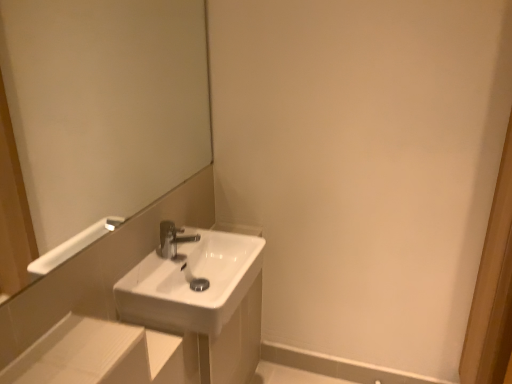
Question: Is white glossy mirror at upper left located within white glossy sink at center?

Choices:
 (A) no
 (B) yes

Answer: (A)

Question: Is white glossy sink at center oriented towards white glossy mirror at upper left?

Choices:
 (A) yes
 (B) no

Answer: (B)

Question: Can we say white glossy sink at center lies outside white glossy mirror at upper left?

Choices:
 (A) no
 (B) yes

Answer: (B)

Question: Is white glossy mirror at upper left at the back of white glossy sink at center?

Choices:
 (A) no
 (B) yes

Answer: (A)

Question: Can you confirm if white glossy sink at center is wider than white glossy mirror at upper left?

Choices:
 (A) yes
 (B) no

Answer: (A)

Question: Does white glossy sink at center have a lesser width compared to white glossy mirror at upper left?

Choices:
 (A) no
 (B) yes

Answer: (A)

Question: Is white glossy mirror at upper left aimed at white glossy sink at center?

Choices:
 (A) yes
 (B) no

Answer: (B)

Question: Can you confirm if white glossy mirror at upper left is positioned to the left of white glossy sink at center?

Choices:
 (A) no
 (B) yes

Answer: (B)

Question: From the image's perspective, is white glossy mirror at upper left above white glossy sink at center?

Choices:
 (A) no
 (B) yes

Answer: (B)

Question: From a real-world perspective, is white glossy mirror at upper left positioned over white glossy sink at center based on gravity?

Choices:
 (A) no
 (B) yes

Answer: (B)

Question: Considering the relative sizes of white glossy mirror at upper left and white glossy sink at center in the image provided, is white glossy mirror at upper left wider than white glossy sink at center?

Choices:
 (A) no
 (B) yes

Answer: (A)

Question: Can you confirm if white glossy mirror at upper left is smaller than white glossy sink at center?

Choices:
 (A) yes
 (B) no

Answer: (B)

Question: In terms of size, does white glossy mirror at upper left appear bigger or smaller than white glossy sink at center?

Choices:
 (A) big
 (B) small

Answer: (A)